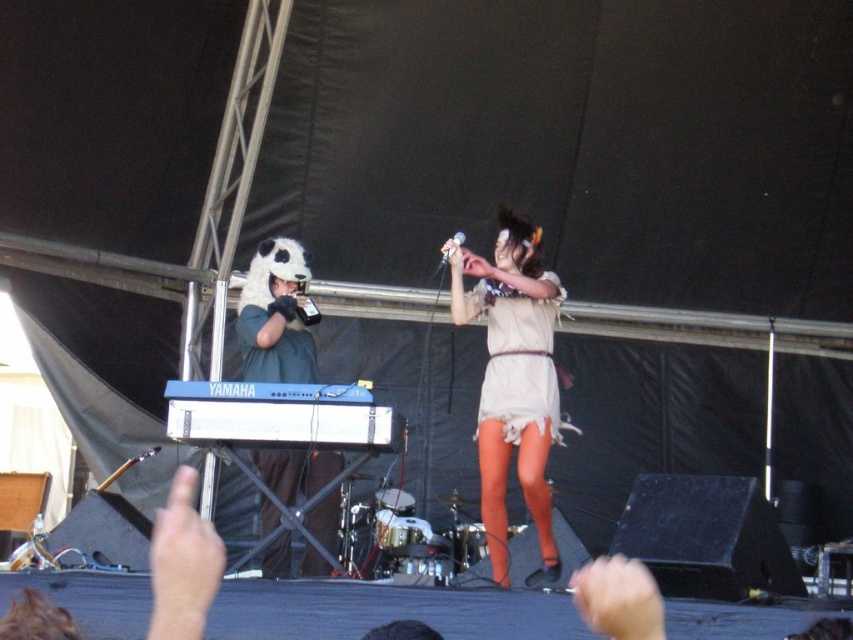
You are a photographer at the concert and want to capture both performers in a single frame. Which performer should you focus on first to ensure the light beige fabric dress at center is in the foreground?

The light beige fabric dress at center has a larger size compared to beige fabric dress at center, so you should focus on the performer wearing the light beige fabric dress at center first to ensure it appears larger in the foreground.

You are a photographer at the concert and want to capture a clear shot of the white plush panda hat at left and the white plastic keyboard at center. Which object should you focus on first if you want to ensure both are in focus without moving the camera?

The white plush panda hat at left is positioned under the white plastic keyboard at center, so focusing on the keyboard first will help ensure both are in focus since it is closer to the background.